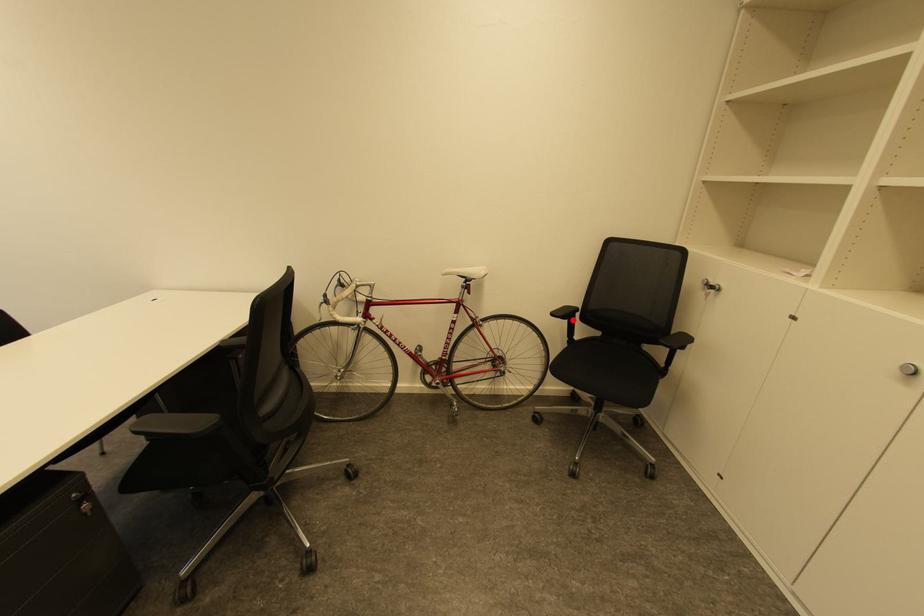
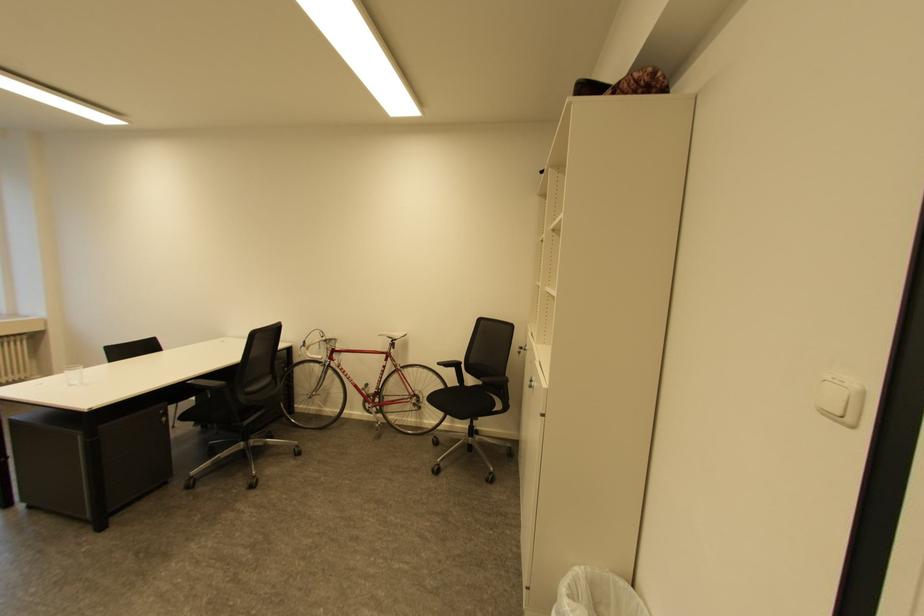
Question: I am providing you with two images of the same scene from different viewpoints. A red point is marked on the first image. Is the red point's position out of view in image 2?

Choices:
 (A) Yes
 (B) No

Answer: (B)